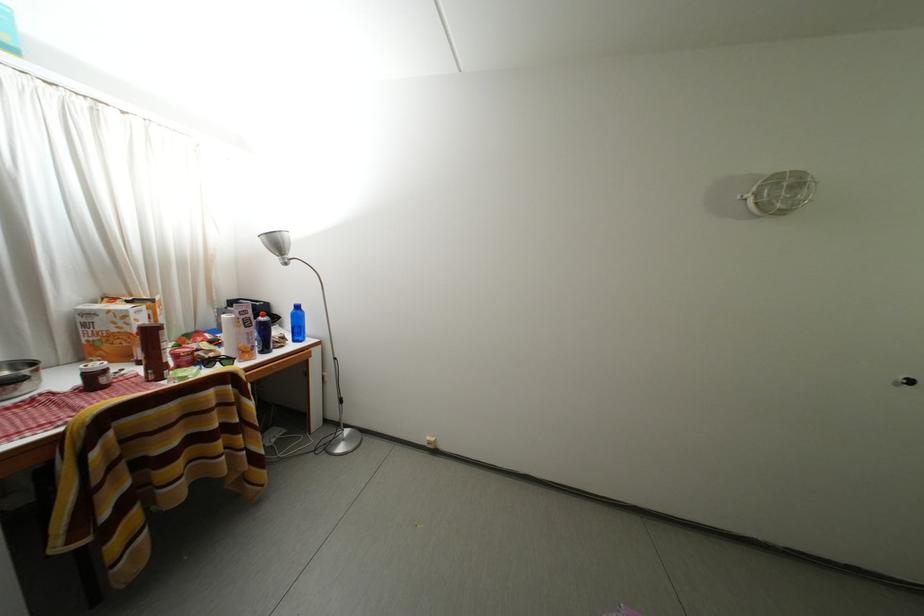
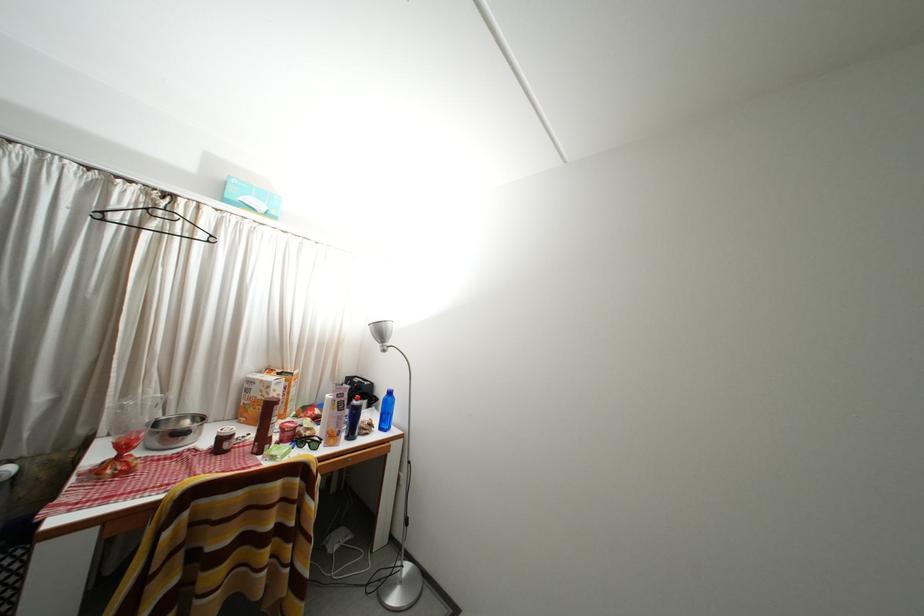
In the second image, find the point that corresponds to the point at 98,318 in the first image.

(259, 387)